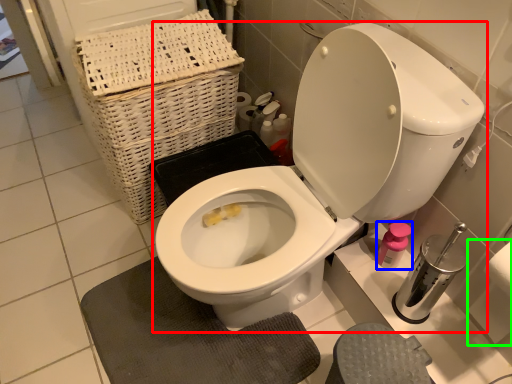
Question: Considering the real-world distances, which object is closest to toilet (highlighted by a red box)? toiletry (highlighted by a blue box) or toilet paper (highlighted by a green box).

Choices:
 (A) toiletry
 (B) toilet paper

Answer: (A)